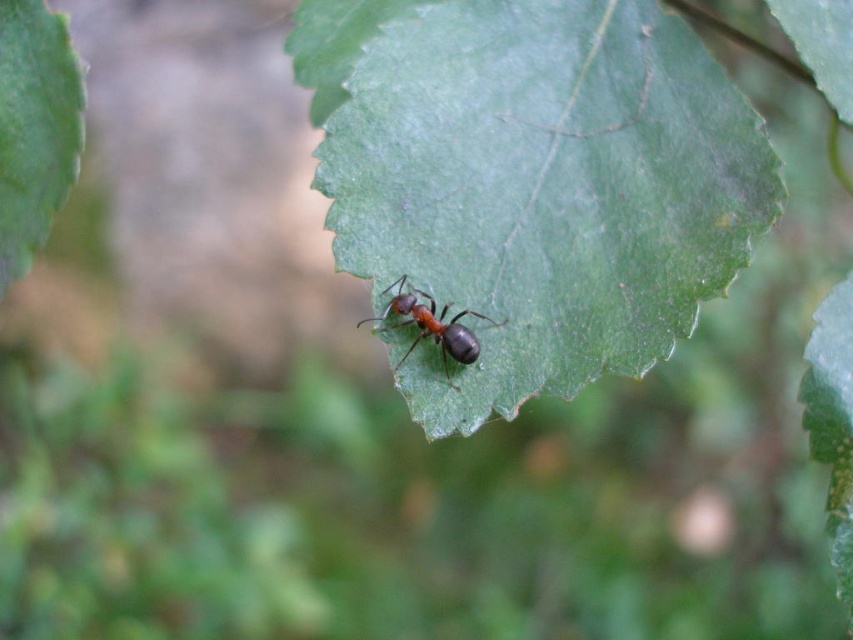
Question: Which object appears closest to the camera in this image?

Choices:
 (A) green matte leaf at upper left
 (B) shiny black ant at center

Answer: (A)

Question: Estimate the real-world distances between objects in this image. Which object is farther from the green matte leaf at upper left?

Choices:
 (A) green matte leaf at center
 (B) shiny black ant at center

Answer: (A)

Question: Can you confirm if green matte leaf at center is thinner than shiny black ant at center?

Choices:
 (A) yes
 (B) no

Answer: (B)

Question: Is the position of green matte leaf at center less distant than that of green matte leaf at upper left?

Choices:
 (A) yes
 (B) no

Answer: (B)

Question: Which point is farther to the camera?

Choices:
 (A) green matte leaf at center
 (B) shiny black ant at center
 (C) green matte leaf at upper left

Answer: (B)

Question: Does green matte leaf at center appear over shiny black ant at center?

Choices:
 (A) yes
 (B) no

Answer: (A)